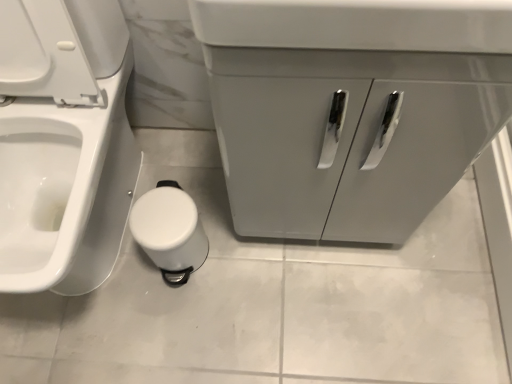
Locate an element on the screen. The image size is (512, 384). free space above white plastic toilet paper at lower center (from a real-world perspective) is located at coordinates (158, 215).